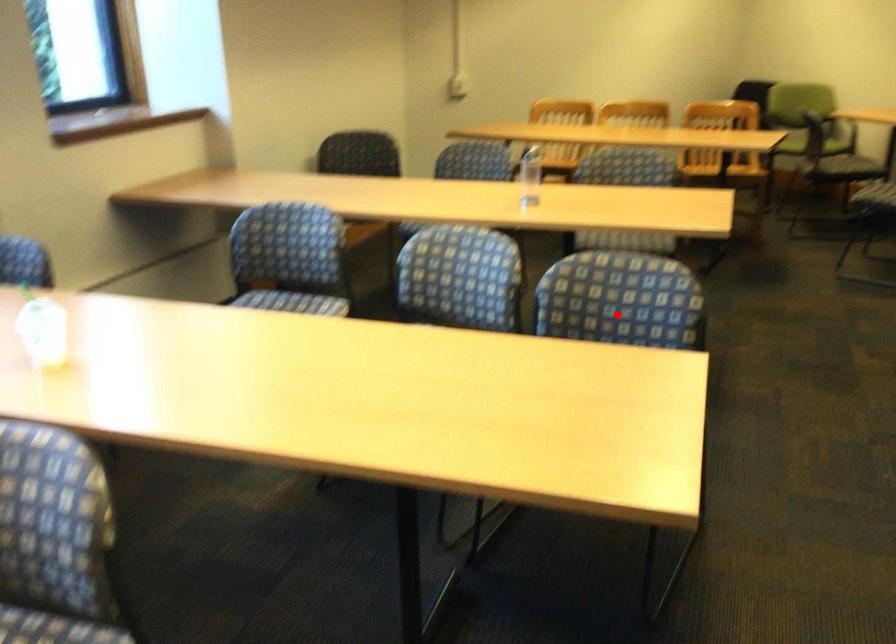
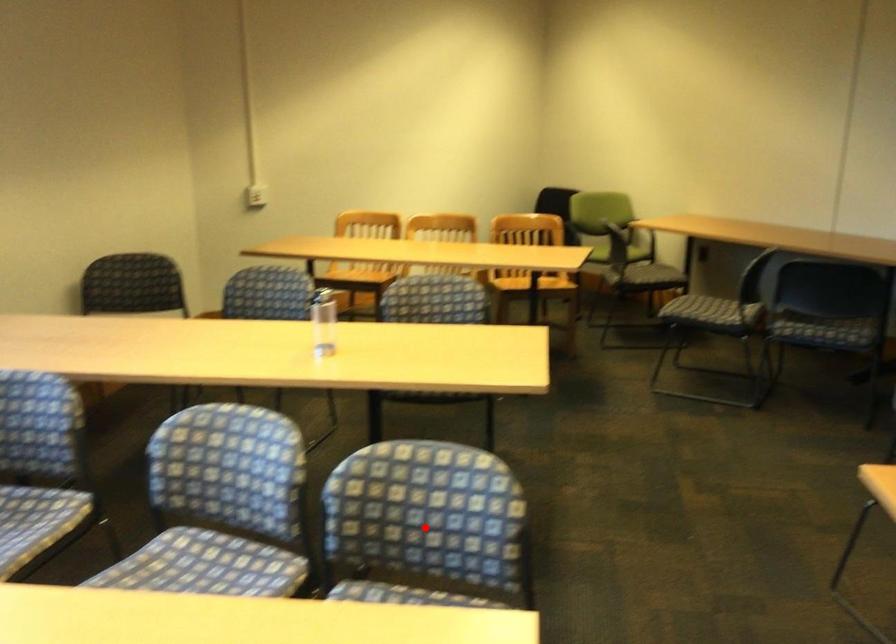
I am providing you with two images of the same scene from different viewpoints. A red point is marked on the first image and another point is marked on the second image. Is the red point in image1 aligned with the point shown in image2?

Yes